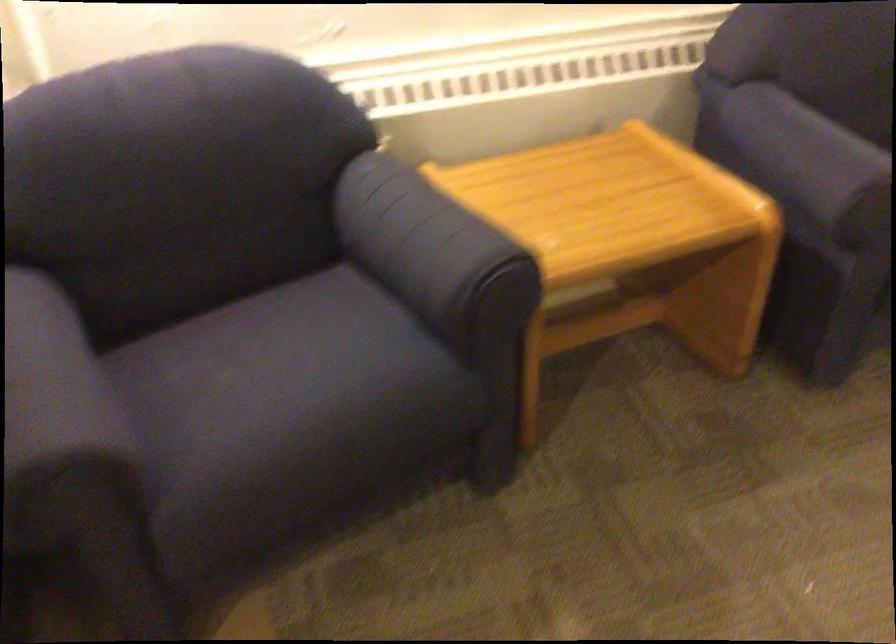
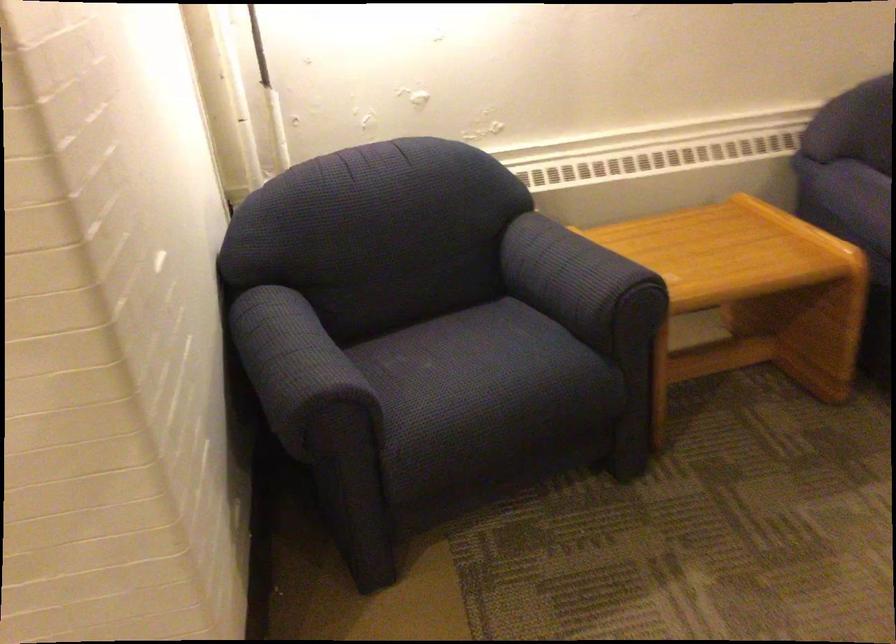
Locate, in the second image, the point that corresponds to (426,261) in the first image.

(579, 281)